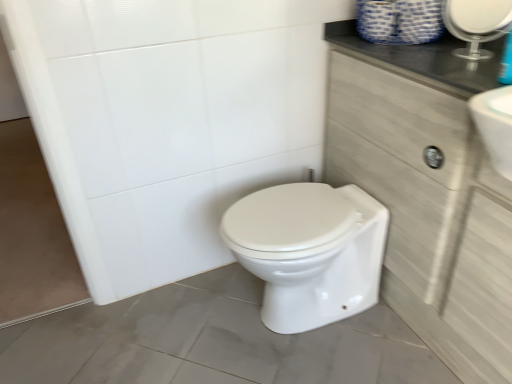
Question: Should I look upward or downward to see light wood cabinet at right?

Choices:
 (A) up
 (B) down

Answer: (A)

Question: From a real-world perspective, is light wood cabinet at right on clear glass mirror at upper right?

Choices:
 (A) yes
 (B) no

Answer: (B)

Question: From a real-world perspective, is light wood cabinet at right located beneath clear glass mirror at upper right?

Choices:
 (A) yes
 (B) no

Answer: (A)

Question: Is light wood cabinet at right at the right side of clear glass mirror at upper right?

Choices:
 (A) no
 (B) yes

Answer: (A)

Question: Would you say light wood cabinet at right contains clear glass mirror at upper right?

Choices:
 (A) no
 (B) yes

Answer: (A)

Question: Considering the relative sizes of light wood cabinet at right and clear glass mirror at upper right in the image provided, is light wood cabinet at right bigger than clear glass mirror at upper right?

Choices:
 (A) no
 (B) yes

Answer: (B)

Question: Is light wood cabinet at right taller than clear glass mirror at upper right?

Choices:
 (A) no
 (B) yes

Answer: (B)

Question: Does light wood cabinet at right have a lesser height compared to white glossy bidet at center?

Choices:
 (A) yes
 (B) no

Answer: (B)

Question: Is light wood cabinet at right surrounding white glossy bidet at center?

Choices:
 (A) yes
 (B) no

Answer: (B)

Question: Considering the relative sizes of light wood cabinet at right and white glossy bidet at center in the image provided, is light wood cabinet at right smaller than white glossy bidet at center?

Choices:
 (A) yes
 (B) no

Answer: (B)

Question: Is light wood cabinet at right positioned before white glossy bidet at center?

Choices:
 (A) no
 (B) yes

Answer: (B)

Question: From the image's perspective, is light wood cabinet at right located above white glossy bidet at center?

Choices:
 (A) no
 (B) yes

Answer: (B)

Question: Is light wood cabinet at right at the right side of white glossy bidet at center?

Choices:
 (A) no
 (B) yes

Answer: (B)

Question: Is clear glass mirror at upper right outside white glossy bidet at center?

Choices:
 (A) no
 (B) yes

Answer: (B)